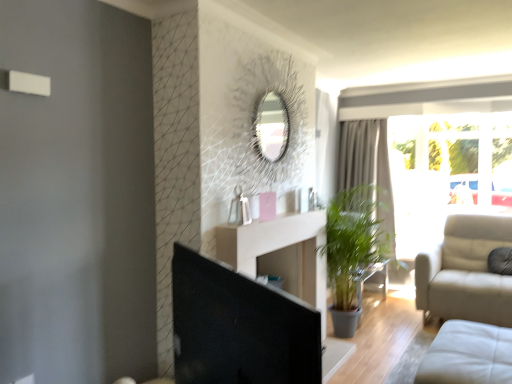
Question: Should I look upward or downward to see black glossy screen door at center?

Choices:
 (A) up
 (B) down

Answer: (B)

Question: Is transparent glass window at right far from gray fabric curtain at center?

Choices:
 (A) no
 (B) yes

Answer: (A)

Question: From the image's perspective, does transparent glass window at right appear lower than gray fabric curtain at center?

Choices:
 (A) yes
 (B) no

Answer: (B)

Question: Can you confirm if transparent glass window at right is bigger than gray fabric curtain at center?

Choices:
 (A) yes
 (B) no

Answer: (A)

Question: Is transparent glass window at right further to the viewer compared to gray fabric curtain at center?

Choices:
 (A) yes
 (B) no

Answer: (B)

Question: From the image's perspective, is transparent glass window at right on top of gray fabric curtain at center?

Choices:
 (A) yes
 (B) no

Answer: (A)

Question: Is gray fabric curtain at center located within transparent glass window at right?

Choices:
 (A) no
 (B) yes

Answer: (A)

Question: From a real-world perspective, does gray fabric curtain at center sit lower than transparent glass window at right?

Choices:
 (A) yes
 (B) no

Answer: (A)

Question: Considering the relative sizes of gray fabric curtain at center and transparent glass window at right in the image provided, is gray fabric curtain at center smaller than transparent glass window at right?

Choices:
 (A) no
 (B) yes

Answer: (B)

Question: Considering the relative positions of gray fabric curtain at center and transparent glass window at right in the image provided, is gray fabric curtain at center to the left of transparent glass window at right from the viewer's perspective?

Choices:
 (A) no
 (B) yes

Answer: (B)

Question: Is gray fabric curtain at center to the right of transparent glass window at right from the viewer's perspective?

Choices:
 (A) no
 (B) yes

Answer: (A)

Question: From a real-world perspective, is gray fabric curtain at center on top of transparent glass window at right?

Choices:
 (A) yes
 (B) no

Answer: (B)

Question: Is gray fabric curtain at center thinner than transparent glass window at right?

Choices:
 (A) no
 (B) yes

Answer: (B)

Question: Is black glossy screen door at center aimed at gray fabric curtain at center?

Choices:
 (A) no
 (B) yes

Answer: (A)